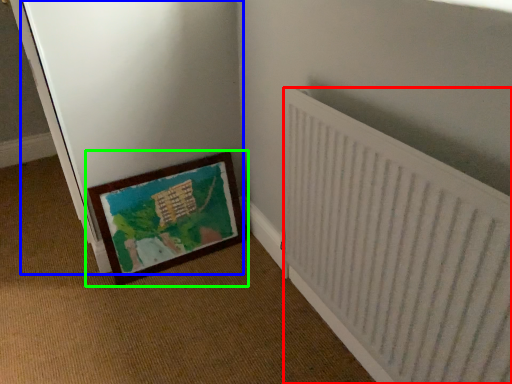
Question: Which object is the closest to the radiator (highlighted by a red box)? Choose among these: screen door (highlighted by a blue box) or picture frame (highlighted by a green box).

Choices:
 (A) screen door
 (B) picture frame

Answer: (B)